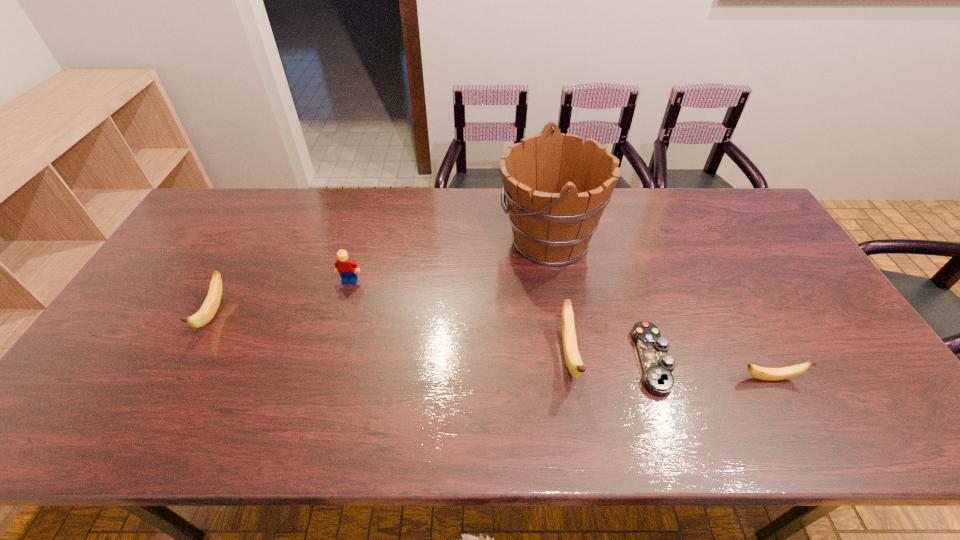
Where is `free spot between the shortest banana and the Lego`? free spot between the shortest banana and the Lego is located at coordinates (560, 329).

What are the coordinates of `unoccupied position between the second object from right to left and the fifth tallest object` in the screenshot? It's located at (711, 369).

The height and width of the screenshot is (540, 960). I want to click on vacant space that is in between the wine bucket and the control, so click(x=600, y=299).

Where is `empty location between the fourth tallest object and the Lego`? empty location between the fourth tallest object and the Lego is located at coordinates (x=281, y=297).

Select which object appears as the closest to the wine bucket. Please provide its 2D coordinates. Your answer should be formatted as a tuple, i.e. [(x, y)], where the tuple contains the x and y coordinates of a point satisfying the conditions above.

[(574, 363)]

Locate an element on the screen. The width and height of the screenshot is (960, 540). object that is the fourth closest to the wine bucket is located at coordinates (770, 374).

Where is `banana that stands as the closest to the wine bucket`? banana that stands as the closest to the wine bucket is located at coordinates (574, 363).

Find the location of a particular element. The height and width of the screenshot is (540, 960). banana that can be found as the second closest to the leftmost banana is located at coordinates (770, 374).

At what (x,y) coordinates should I click in order to perform the action: click on free space that satisfies the following two spatial constraints: 1. at the stem of the second banana from right to left; 2. on the right side of the control. Please return your answer as a coordinate pair (x, y). Looking at the image, I should click on (569, 360).

Find the location of `vacant space that satisfies the following two spatial constraints: 1. with the handle on the control; 2. on the right side of the tallest object`. vacant space that satisfies the following two spatial constraints: 1. with the handle on the control; 2. on the right side of the tallest object is located at coordinates (568, 360).